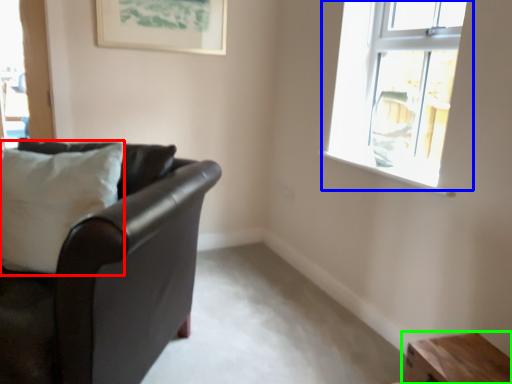
Question: Based on their relative distances, which object is farther from pillow (highlighted by a red box)? Choose from window (highlighted by a blue box) and table (highlighted by a green box).

Choices:
 (A) window
 (B) table

Answer: (A)